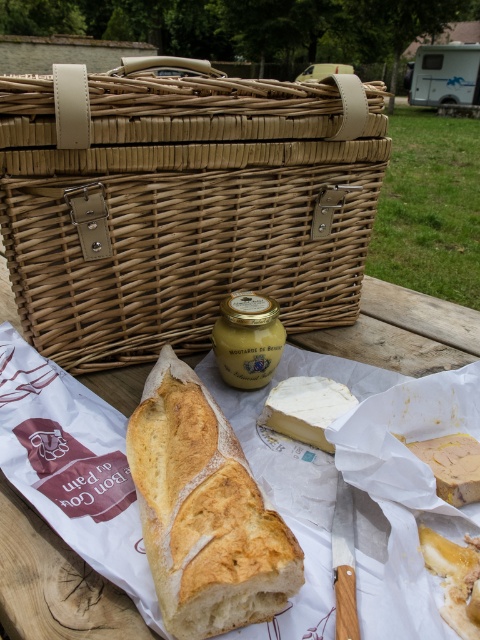
Question: Can you confirm if woven wood picnic basket at upper center is positioned to the right of white creamy cheese at center?

Choices:
 (A) yes
 (B) no

Answer: (B)

Question: Which point appears farthest from the camera in this image?

Choices:
 (A) (327, 387)
 (B) (232, 566)
 (C) (299, 109)

Answer: (C)

Question: Can you confirm if golden brown crusty loaf of bread at center is smaller than white creamy cheese at center?

Choices:
 (A) yes
 (B) no

Answer: (B)

Question: Which object appears closest to the camera in this image?

Choices:
 (A) white creamy cheese at center
 (B) woven wood picnic basket at upper center

Answer: (B)

Question: Does woven wood picnic basket at upper center come behind white creamy cheese at center?

Choices:
 (A) no
 (B) yes

Answer: (A)

Question: Based on their relative distances, which object is farther from the white creamy cheese at center?

Choices:
 (A) golden brown crusty loaf of bread at center
 (B) woven wood picnic basket at upper center

Answer: (B)